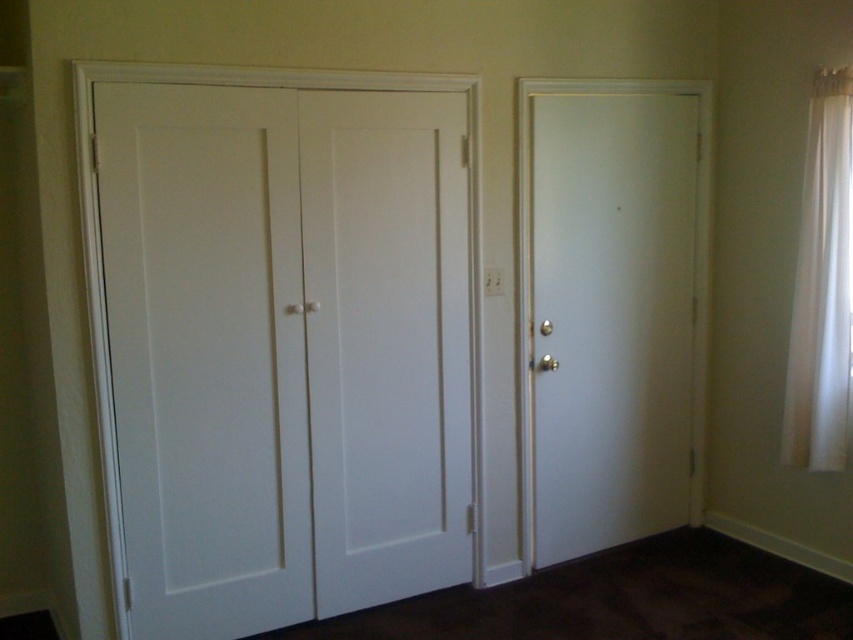
Who is shorter, white matte door at left or white smooth door at center?

Standing shorter between the two is white matte door at left.

Between white matte door at left and white smooth door at center, which one has more height?

white smooth door at center

Image resolution: width=853 pixels, height=640 pixels. I want to click on white matte door at left, so click(206, 355).

This screenshot has width=853, height=640. Find the location of `white matte door at left`. white matte door at left is located at coordinates point(206,355).

Which is above, white matte door at left or white smooth door at right?

white smooth door at right is above.

Describe the element at coordinates (206, 355) in the screenshot. The height and width of the screenshot is (640, 853). I see `white matte door at left` at that location.

Describe the element at coordinates (206, 355) in the screenshot. I see `white matte door at left` at that location.

Locate an element on the screen. The image size is (853, 640). white matte door at left is located at coordinates (206, 355).

In the scene shown: Measure the distance between white matte door at left and white sheer curtain at right.

7.59 feet

Between white matte door at left and white sheer curtain at right, which one has more height?

Answer: Standing taller between the two is white matte door at left.

What do you see at coordinates (206, 355) in the screenshot? I see `white matte door at left` at bounding box center [206, 355].

This screenshot has width=853, height=640. What are the coordinates of `white matte door at left` in the screenshot? It's located at (206, 355).